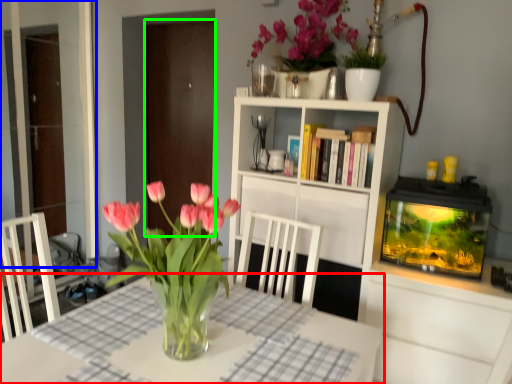
Question: Which object is the farthest from table (highlighted by a red box)? Choose among these: glass door (highlighted by a blue box) or glass door (highlighted by a green box).

Choices:
 (A) glass door
 (B) glass door

Answer: (A)